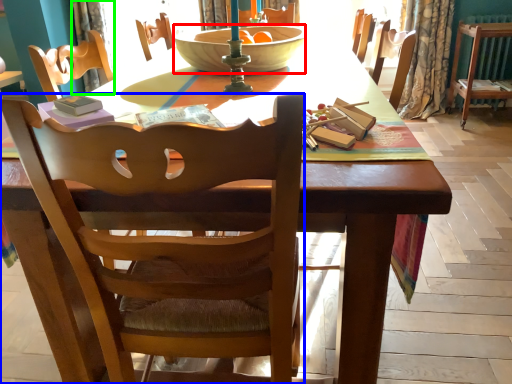
Question: Based on their relative distances, which object is farther from bowl (highlighted by a red box)? Choose from chair (highlighted by a blue box) and curtain (highlighted by a green box).

Choices:
 (A) chair
 (B) curtain

Answer: (B)